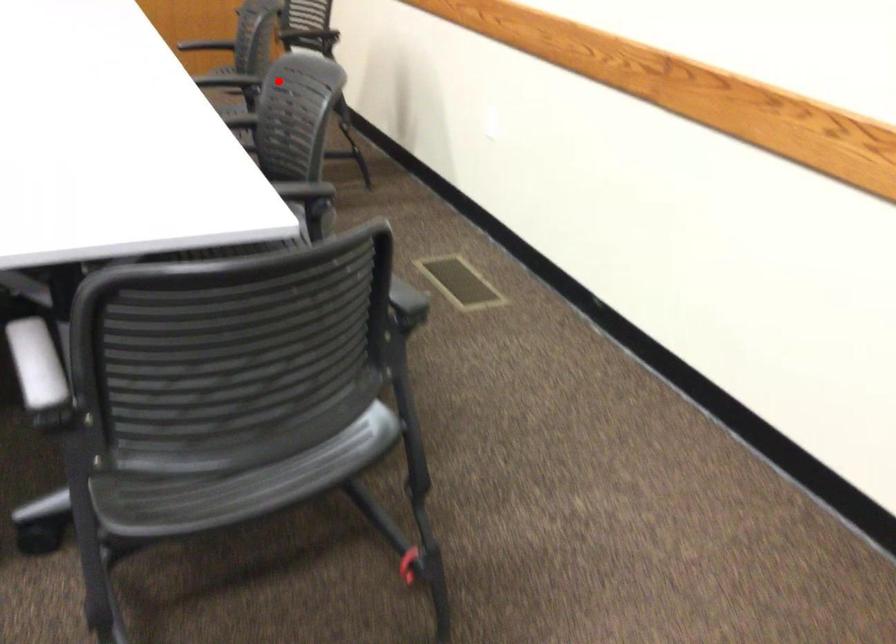
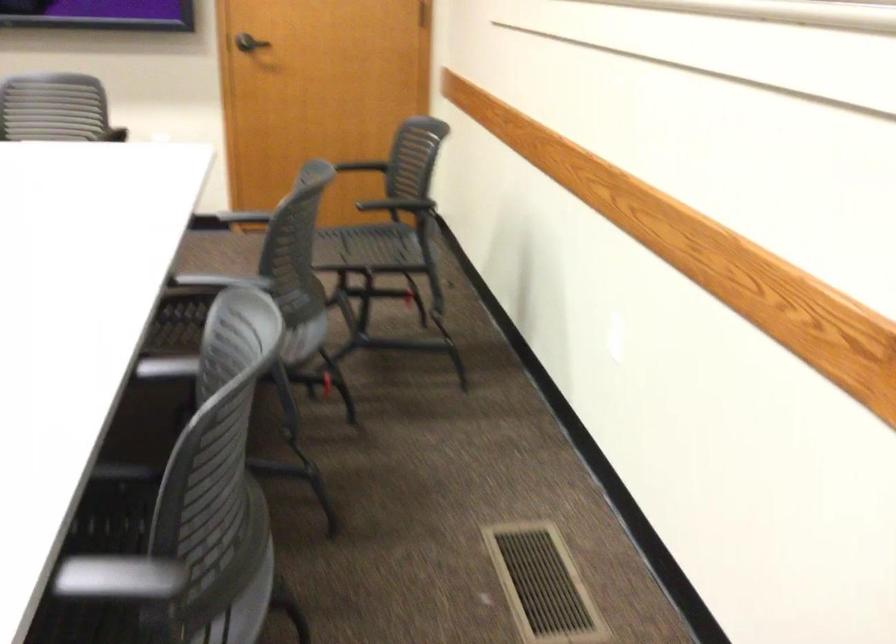
Where in the second image is the point corresponding to the highlighted location from the first image?

(225, 319)